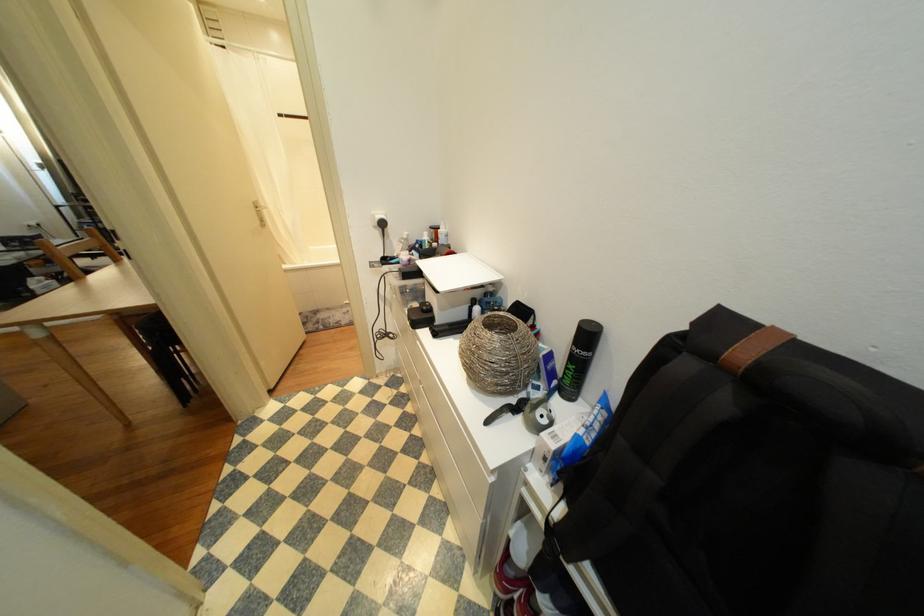
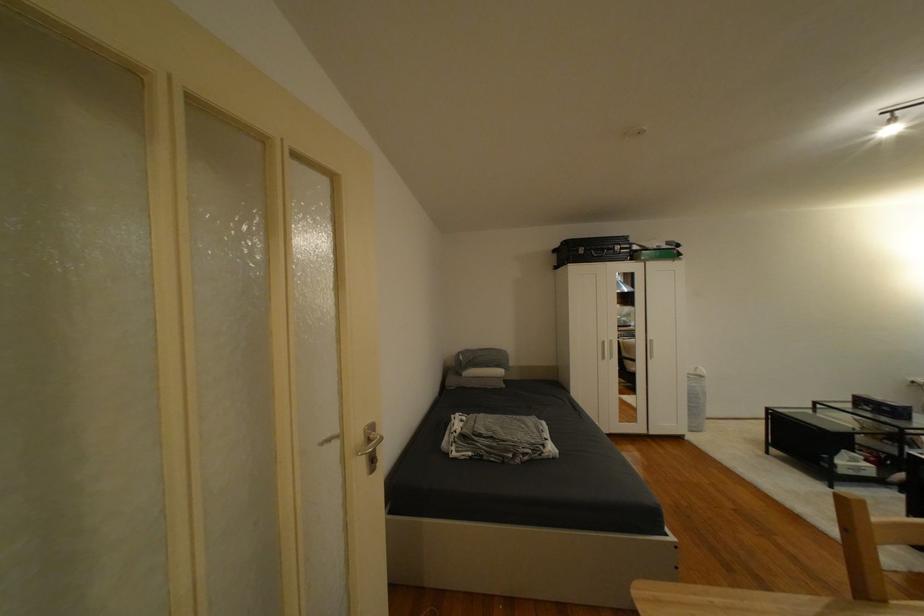
In the second image, find the point that corresponds to point 37,241 in the first image.

(894, 410)